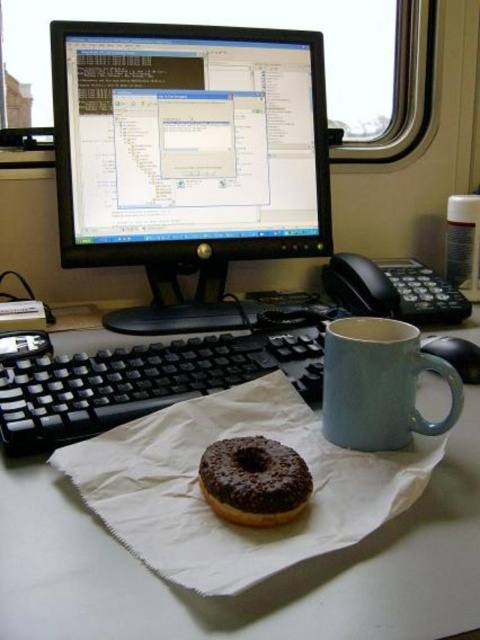
You are standing in front of a workspace with a computer monitor, keyboard, a chocolate donut on parchment paper, a light blue mug, and a black telephone. You want to reach the point at coordinates (x=99, y=525) on the monitor. If your hand can extend 40 centimeters forward, will you be able to touch that point?

The point at coordinates (x=99, y=525) is 44.09 centimeters away from the viewer. Since your hand can only extend 40 centimeters, you will not be able to touch the point at coordinates (x=99, y=525).